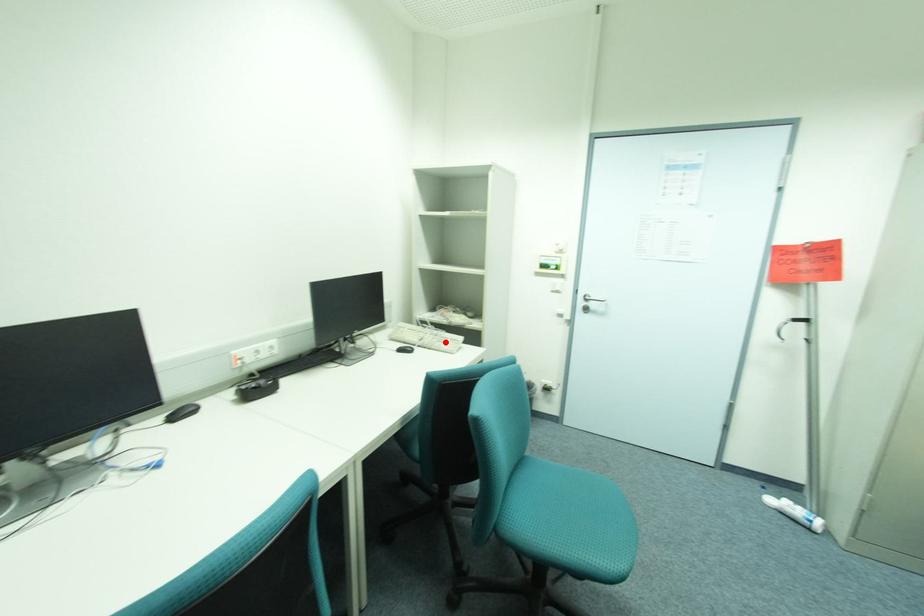
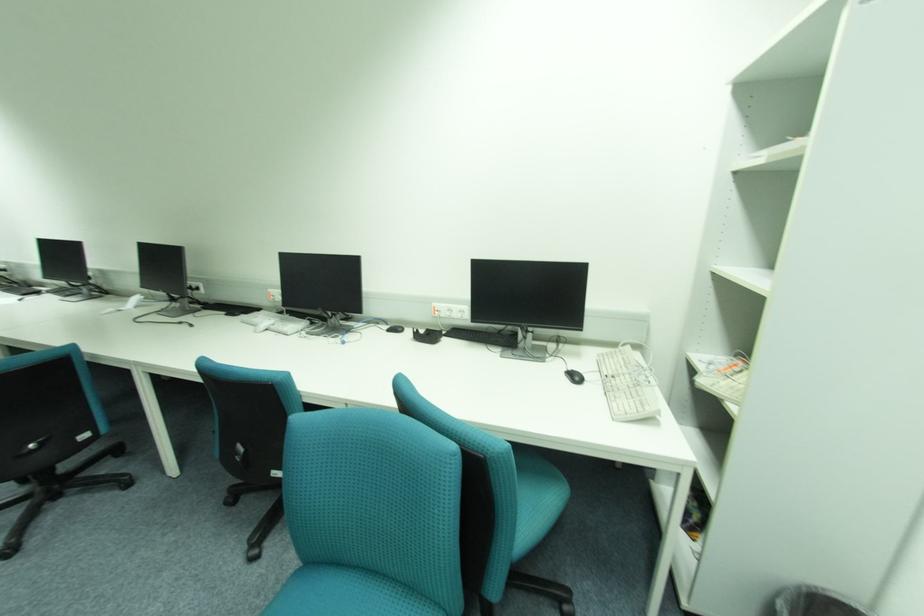
Find the pixel in the second image that matches the highlighted location in the first image.

(631, 392)